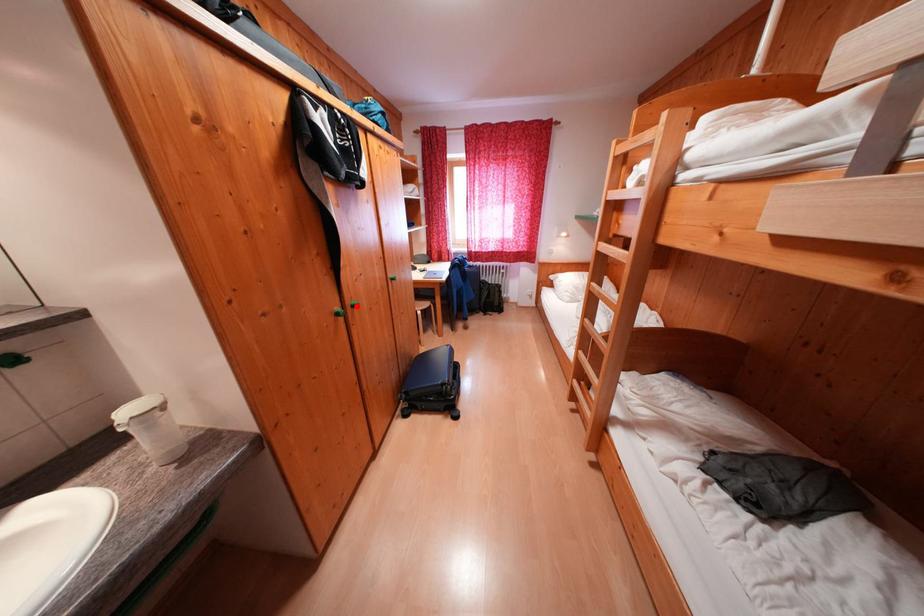
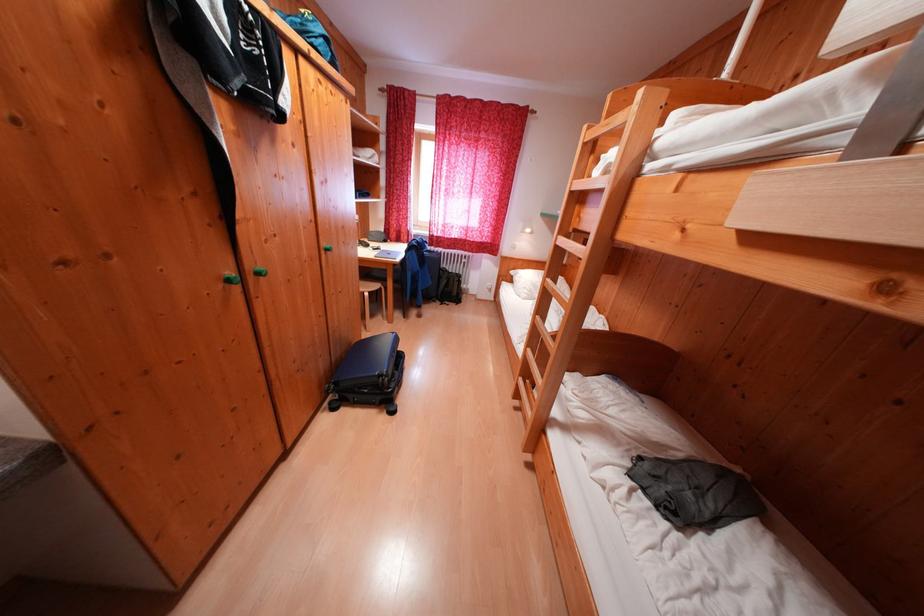
Locate, in the second image, the point that corresponds to the highlighted location in the first image.

(258, 272)